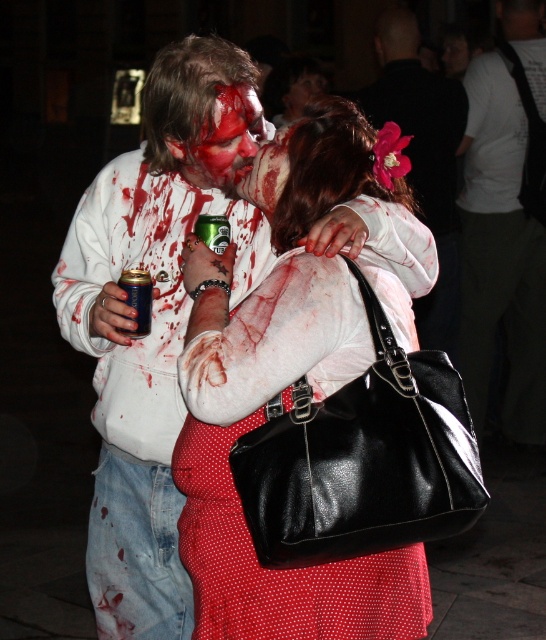
You are at a Halloween party and need to locate the matte white blouse at center and the blue matte can at center. From the perspective of someone standing in front of these items, which one is positioned to the right of the other?

The matte white blouse at center is to the right of the blue matte can at center.

You are a photographer at the Halloween event and need to capture a photo where the matte white blouse at center is clearly visible above the blue matte can at center. Based on their sizes, is this possible?

Yes, since the matte white blouse at center is taller than the blue matte can at center, it can be positioned to be visible above it in the photo.

You are a photographer standing at the event. You want to take a photo of the matte white blouse at center. What is the ideal distance you should maintain to capture it clearly?

The ideal distance to capture the matte white blouse at center clearly is approximately 2.03 meters, as that is its distance from the camera.